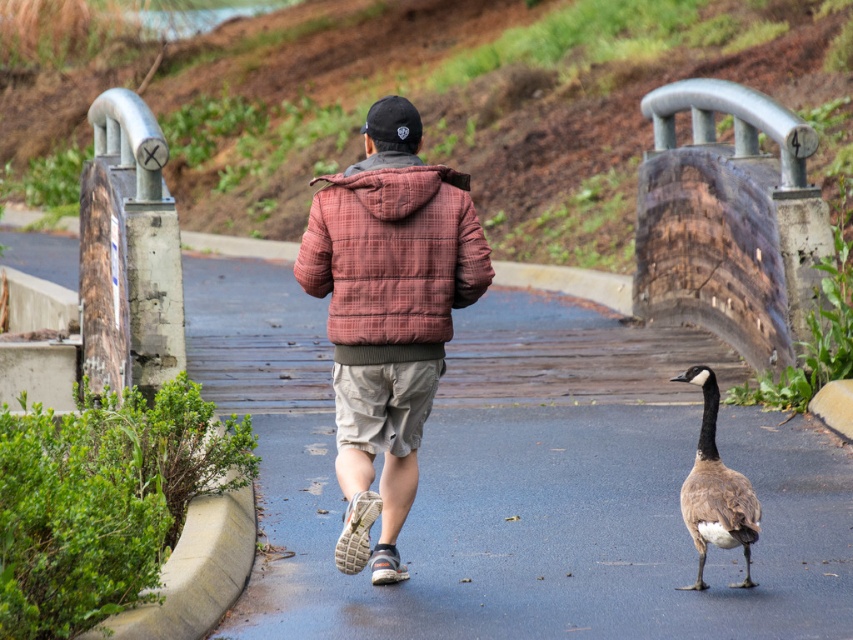
Question: Can you confirm if smooth asphalt road at center is smaller than plaid cotton jacket at center?

Choices:
 (A) yes
 (B) no

Answer: (B)

Question: Estimate the real-world distances between objects in this image. Which object is farther from the smooth asphalt road at center?

Choices:
 (A) plaid cotton jacket at center
 (B) brown feathered duck at center

Answer: (B)

Question: Estimate the real-world distances between objects in this image. Which object is closer to the plaid cotton jacket at center?

Choices:
 (A) brown feathered duck at center
 (B) smooth asphalt road at center

Answer: (A)

Question: Can you confirm if smooth asphalt road at center is positioned below brown feathered duck at center?

Choices:
 (A) no
 (B) yes

Answer: (A)

Question: Is plaid cotton jacket at center bigger than brown feathered duck at center?

Choices:
 (A) yes
 (B) no

Answer: (A)

Question: Which point is closer to the camera?

Choices:
 (A) (816, 458)
 (B) (399, 208)

Answer: (B)